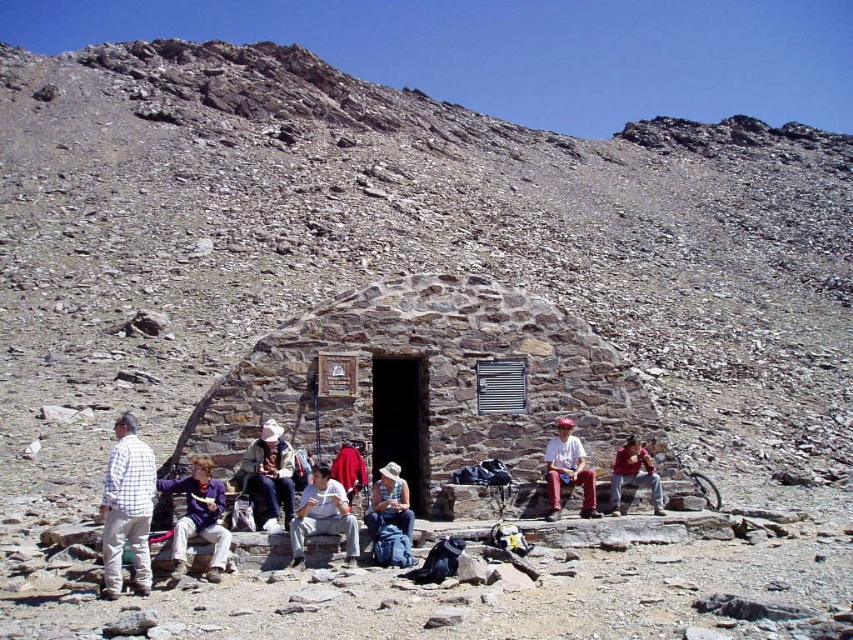
Which of these two, light blue jeans at center or matte red pants at center, stands taller?

Standing taller between the two is matte red pants at center.

Does light blue jeans at center have a lesser width compared to matte red pants at center?

In fact, light blue jeans at center might be wider than matte red pants at center.

Is point (294, 520) closer to camera compared to point (589, 484)?

Yes, it is in front of point (589, 484).

Find the location of `light blue jeans at center`. light blue jeans at center is located at coordinates (323, 516).

Which is below, light blue jeans at center or denim pants at center?

light blue jeans at center is below.

Which is in front, point (299, 560) or point (399, 513)?

Point (299, 560) is more forward.

This screenshot has width=853, height=640. I want to click on light blue jeans at center, so click(x=323, y=516).

Is stone textured hut at center in front of light blue jeans at center?

That is False.

Does stone textured hut at center have a lesser width compared to light blue jeans at center?

In fact, stone textured hut at center might be wider than light blue jeans at center.

At what (x,y) coordinates should I click in order to perform the action: click on stone textured hut at center. Please return your answer as a coordinate pair (x, y). The image size is (853, 640). Looking at the image, I should click on (428, 387).